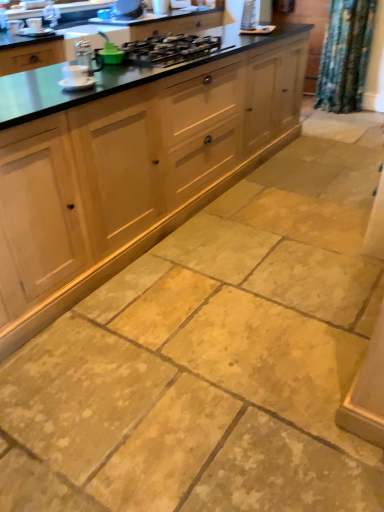
I want to click on free location to the right of green plastic brush at upper center, the 2th appliance when ordered from front to back, so pos(143,62).